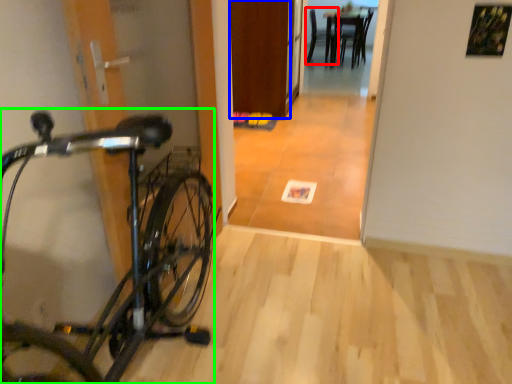
Question: Which object is positioned farthest from chair (highlighted by a red box)? Select from door (highlighted by a blue box) and bicycle (highlighted by a green box).

Choices:
 (A) door
 (B) bicycle

Answer: (B)